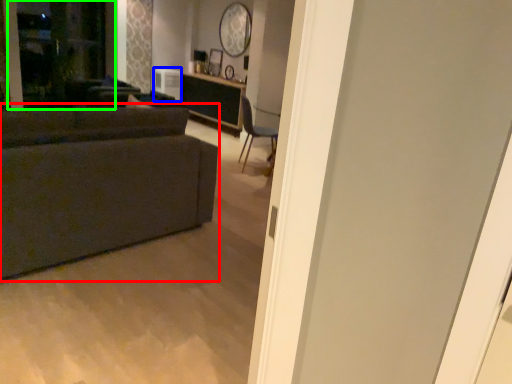
Question: Which object is the closest to the studio couch (highlighted by a red box)? Choose among these: appliance (highlighted by a blue box) or screen door (highlighted by a green box).

Choices:
 (A) appliance
 (B) screen door

Answer: (B)